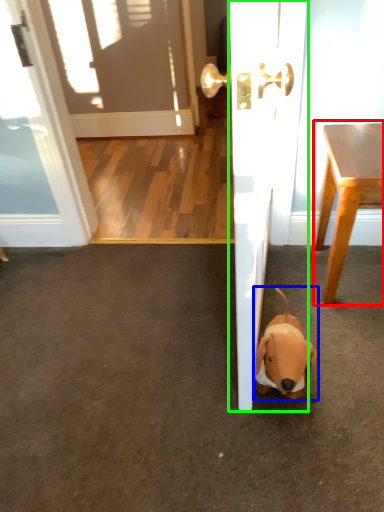
Question: Based on their relative distances, which object is farther from table (highlighted by a red box)? Choose from dog (highlighted by a blue box) and door (highlighted by a green box).

Choices:
 (A) dog
 (B) door

Answer: (A)